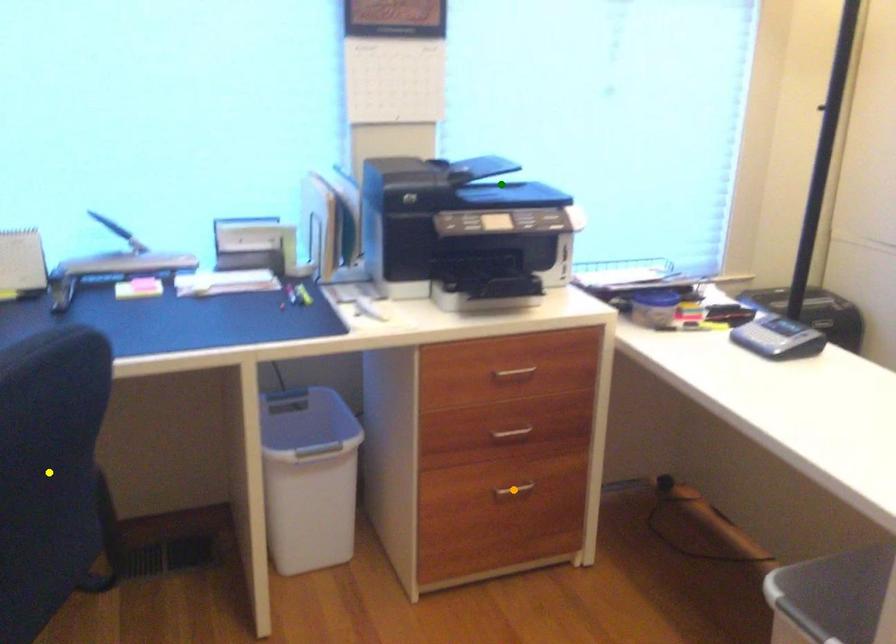
Order these from nearest to farthest:
A) orange point
B) green point
C) yellow point

green point → orange point → yellow point